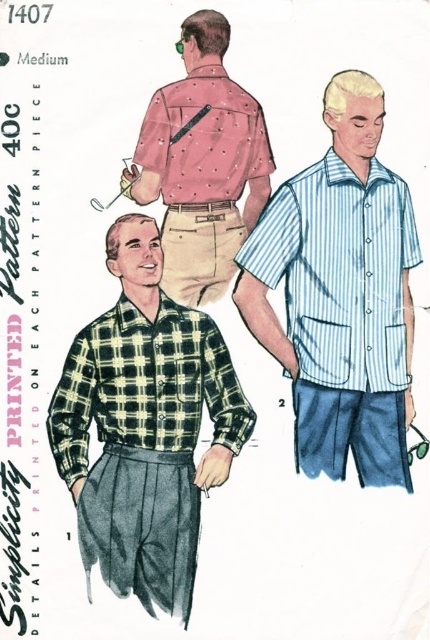
Is the position of pink dotted shirt at upper center more distant than that of pink dotted fabric shirt at back?

No, pink dotted shirt at upper center is closer to the viewer.

Who is higher up, pink dotted shirt at upper center or pink dotted fabric shirt at back?

pink dotted fabric shirt at back

Identify the location of pink dotted shirt at upper center. The image size is (430, 640). (202, 164).

Identify the location of pink dotted shirt at upper center. (202, 164).

Measure the distance from light blue striped shirt at right to pink dotted fabric shirt at back.

23.21 centimeters

Can you confirm if light blue striped shirt at right is wider than pink dotted fabric shirt at back?

Yes.

Which is behind, point (405, 484) or point (242, 164)?

Point (242, 164)

I want to click on light blue striped shirt at right, so click(340, 294).

Which is above, green plaid shirt at center or pink dotted shirt at upper center?

Positioned higher is pink dotted shirt at upper center.

Who is positioned more to the left, green plaid shirt at center or pink dotted shirt at upper center?

green plaid shirt at center is more to the left.

Identify the location of green plaid shirt at center. (144, 426).

Locate an element on the screen. The image size is (430, 640). green plaid shirt at center is located at coordinates (144, 426).